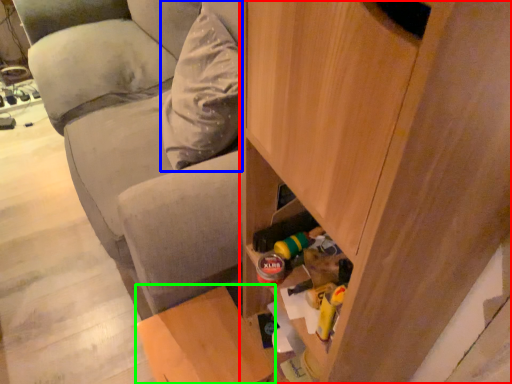
Question: Which object is positioned closest to cabinetry (highlighted by a red box)? Select from pillow (highlighted by a blue box) and furniture (highlighted by a green box).

Choices:
 (A) pillow
 (B) furniture

Answer: (B)